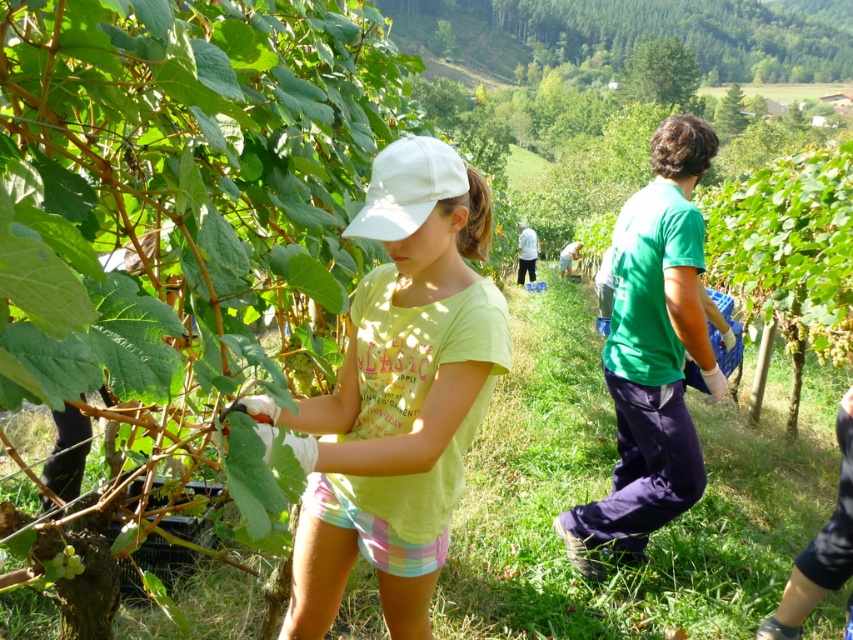
You are standing in the vineyard and see two points marked in the scene. Which point is nearer to you, point (402, 266) or point (61, 570)?

Point (402, 266) is closer to the camera than point (61, 570), so it is nearer to you.

What is the exact coordinate of the light green cotton shirt at center?

The light green cotton shirt at center is located at point (x=397, y=394).

You are a farmer who needs to reach the green matte grapes at lower left from your current position near the light green cotton shirt at center. Can you walk straight to them without needing to move any obstacles?

The distance between the light green cotton shirt at center and the green matte grapes at lower left is 35.06 inches, so yes, you can walk straight to them without needing to move any obstacles since there is enough space.